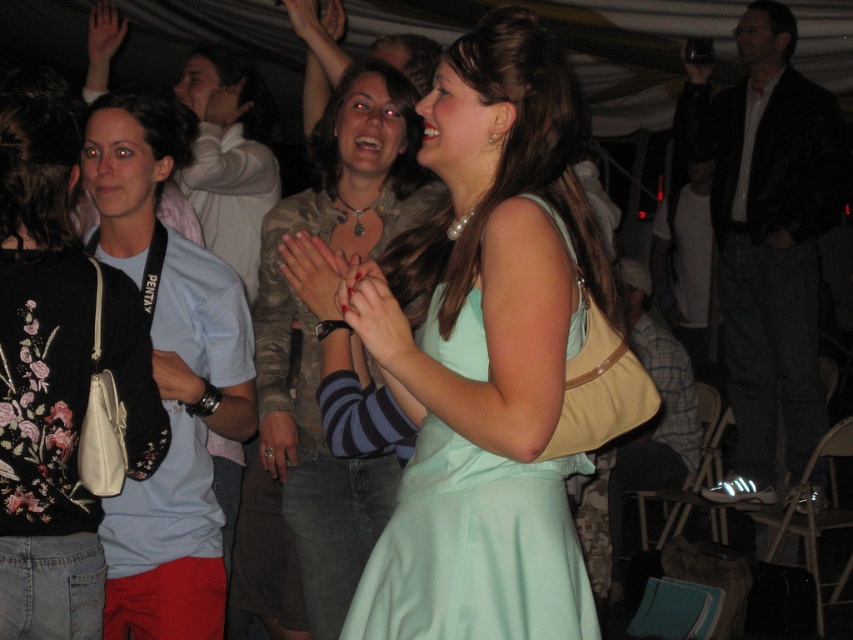
Question: Which point is farther from the camera taking this photo?

Choices:
 (A) (486, 253)
 (B) (3, 104)
 (C) (352, 202)

Answer: (C)

Question: Is matte black purse at left smaller than camouflage fabric jacket at center?

Choices:
 (A) yes
 (B) no

Answer: (A)

Question: Among these points, which one is farthest from the camera?

Choices:
 (A) (9, 618)
 (B) (294, 412)

Answer: (B)

Question: Is light teal dress at center above camouflage fabric jacket at center?

Choices:
 (A) yes
 (B) no

Answer: (A)

Question: Considering the relative positions of matte black purse at left and camouflage fabric jacket at center in the image provided, where is matte black purse at left located with respect to camouflage fabric jacket at center?

Choices:
 (A) left
 (B) right

Answer: (A)

Question: Which of these objects is positioned closest to the camouflage fabric jacket at center?

Choices:
 (A) matte black purse at left
 (B) light teal dress at center

Answer: (B)